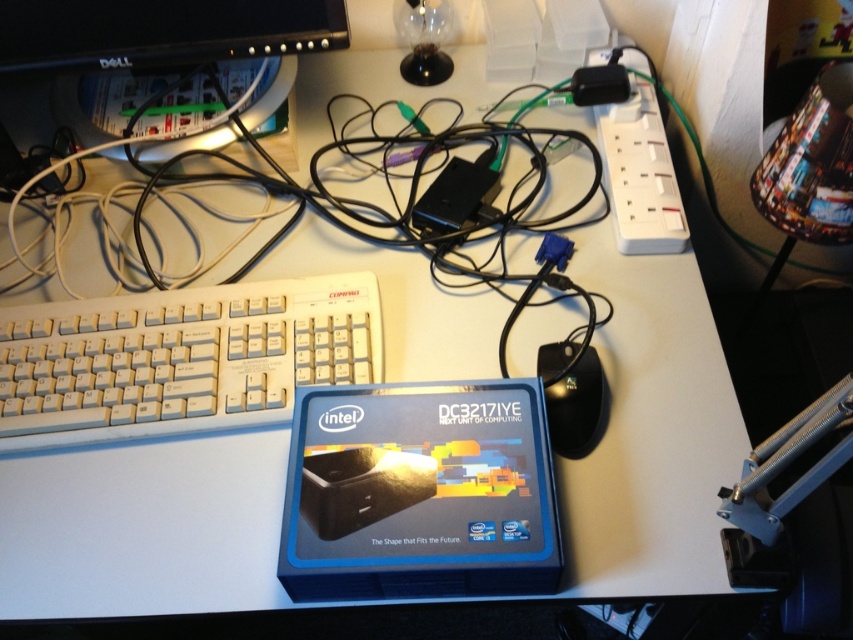
You are a delivery person who just arrived at a client office. You need to place a new keyboard on the desk without moving any existing items. The new keyboard is 12 inches long. The desk has limited space. The existing white plastic keyboard at left is 27.74 inches away from the camera. Can you fit the new keyboard on the desk without overlapping any existing items?

The white plastic keyboard at left is 27.74 inches away from the camera. Since the new keyboard is only 12 inches long, there should be enough space to place it next to or behind the existing keyboard without overlapping, provided there is sufficient space in that direction. However, without knowing the exact dimensions and layout of the desk, it is recommended to check the available space carefully before placing the new keyboard.

You are setting up a new monitor on your desk. The black plastic monitor at upper left is currently plugged into the black plastic plug at upper right. If the plug can only support devices up to its width, will the monitor fit properly?

The black plastic monitor at upper left might be wider than the black plastic plug at upper right, so there is a possibility that the monitor may not fit properly if the plug cannot accommodate its width.

You are setting up a new computer and need to connect the black plastic plug at upper right to the black plastic monitor at upper left. The cable you have is 45 centimeters long. Will the cable be long enough to reach?

The distance between the black plastic monitor at upper left and the black plastic plug at upper right is 47.43 centimeters. Since the cable is only 45 centimeters long, it is shorter than the required distance. Therefore, the cable will not be long enough to reach.